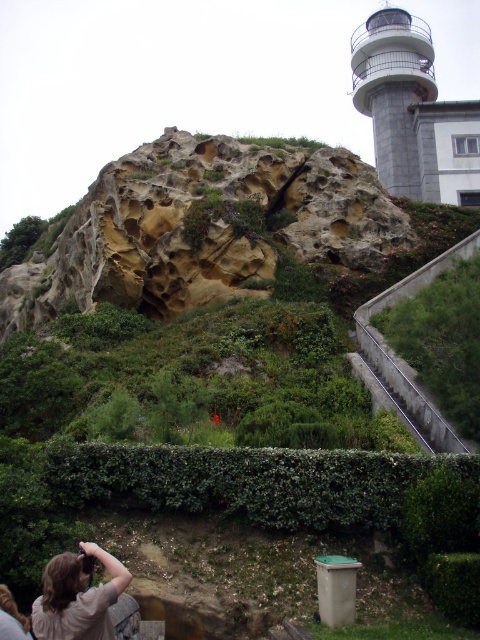
Measure the distance between white stone tower at upper right and camera.

white stone tower at upper right is 260.79 feet from camera.

Can you confirm if white stone tower at upper right is positioned to the right of light brown hair at lower left?

Correct, you'll find white stone tower at upper right to the right of light brown hair at lower left.

Who is more distant from viewer, [388,86] or [72,556]?

The point [388,86] is behind.

Identify the location of white stone tower at upper right. (393, 90).

Which is more to the left, yellowish stone rock at center or white stone tower at upper right?

From the viewer's perspective, yellowish stone rock at center appears more on the left side.

Can you confirm if yellowish stone rock at center is bigger than white stone tower at upper right?

No.

Which is in front, point (312, 163) or point (374, 104)?

Point (312, 163) is in front.

The image size is (480, 640). In order to click on yellowish stone rock at center in this screenshot , I will do `click(204, 230)`.

Can you confirm if green leafy hedge at lower center is positioned to the right of white stone tower at upper right?

In fact, green leafy hedge at lower center is to the left of white stone tower at upper right.

Measure the distance between point (279, 484) and camera.

97.75 feet

The image size is (480, 640). In order to click on green leafy hedge at lower center in this screenshot , I will do `click(248, 481)`.